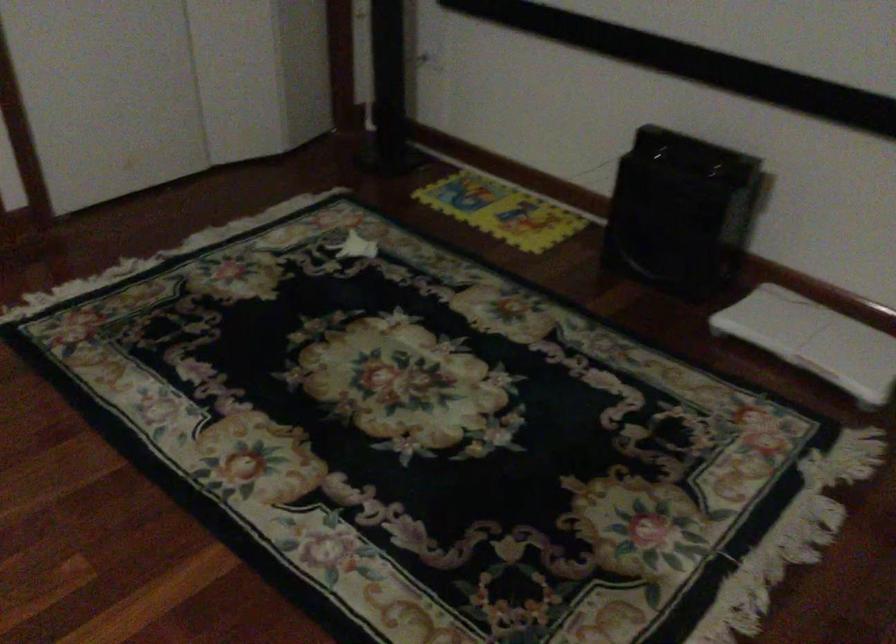
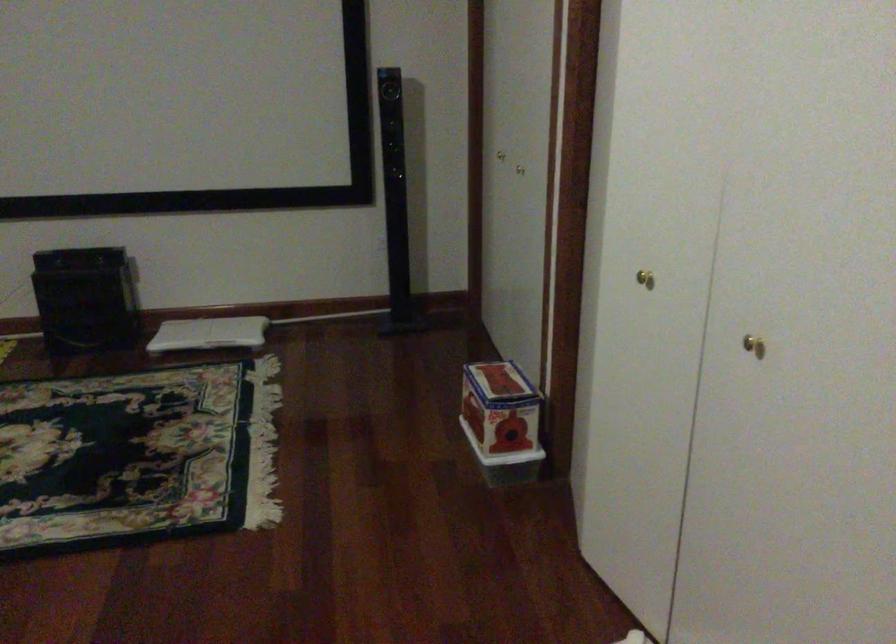
Locate, in the second image, the point that corresponds to the point at 814,350 in the first image.

(209, 333)